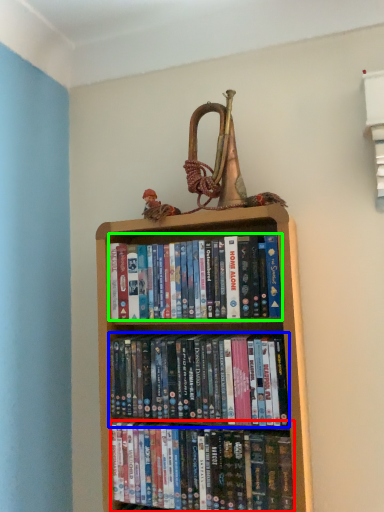
Question: Considering the real-world distances, which object is closest to book (highlighted by a red box)? book (highlighted by a blue box) or book (highlighted by a green box).

Choices:
 (A) book
 (B) book

Answer: (A)